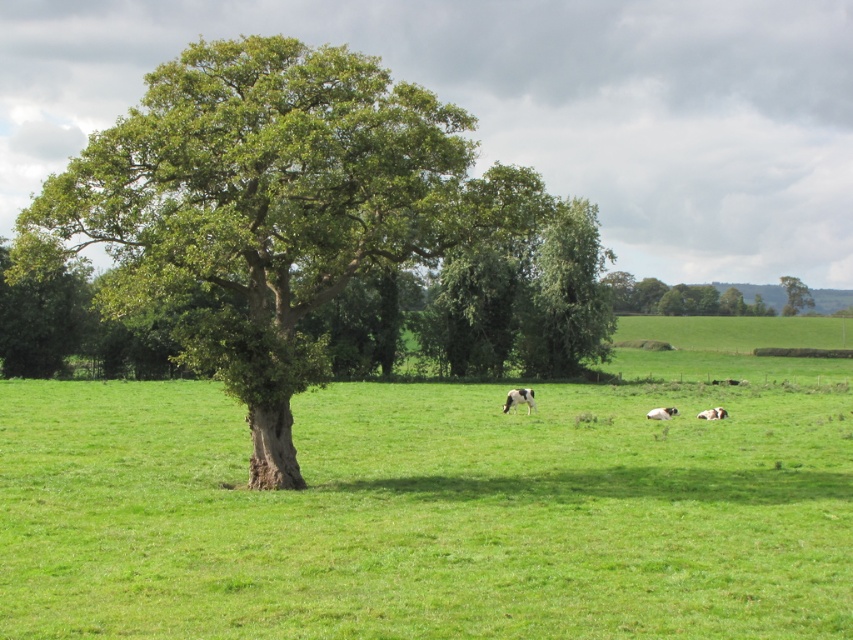
Who is more forward, (509, 404) or (723, 413)?

Positioned in front is point (723, 413).

Which is in front, point (532, 394) or point (715, 410)?

Point (715, 410)

The width and height of the screenshot is (853, 640). In order to click on white-spotted fur at center in this screenshot , I will do `click(519, 400)`.

Can you confirm if green leafy tree at upper right is positioned above white speckled fur at lower right?

Indeed, green leafy tree at upper right is positioned over white speckled fur at lower right.

Between green leafy tree at upper right and white speckled fur at lower right, which one is positioned higher?

green leafy tree at upper right is higher up.

Does point (811, 305) lie in front of point (715, 410)?

No.

Where is `green leafy tree at upper right`? The width and height of the screenshot is (853, 640). green leafy tree at upper right is located at coordinates (795, 296).

Can you confirm if green grass pasture at center is positioned to the left of white speckled fur at lower right?

Yes, green grass pasture at center is to the left of white speckled fur at lower right.

Between green grass pasture at center and white speckled fur at lower right, which one appears on the right side from the viewer's perspective?

white speckled fur at lower right is more to the right.

What do you see at coordinates (444, 502) in the screenshot? Image resolution: width=853 pixels, height=640 pixels. I see `green grass pasture at center` at bounding box center [444, 502].

Identify the location of green grass pasture at center. The width and height of the screenshot is (853, 640). (444, 502).